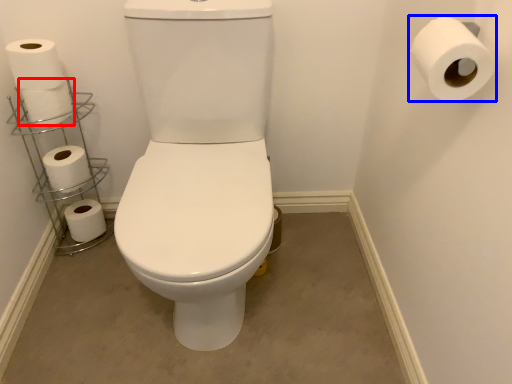
Question: Among these objects, which one is farthest to the camera, toilet paper (highlighted by a red box) or toilet paper (highlighted by a blue box)?

Choices:
 (A) toilet paper
 (B) toilet paper

Answer: (A)